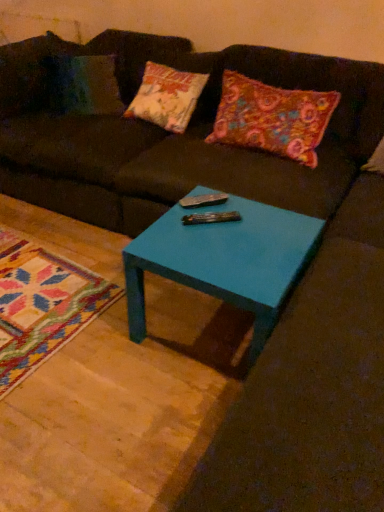
This screenshot has width=384, height=512. What are the coordinates of `free space to the back side of metallic silver remote at center` in the screenshot? It's located at (200, 208).